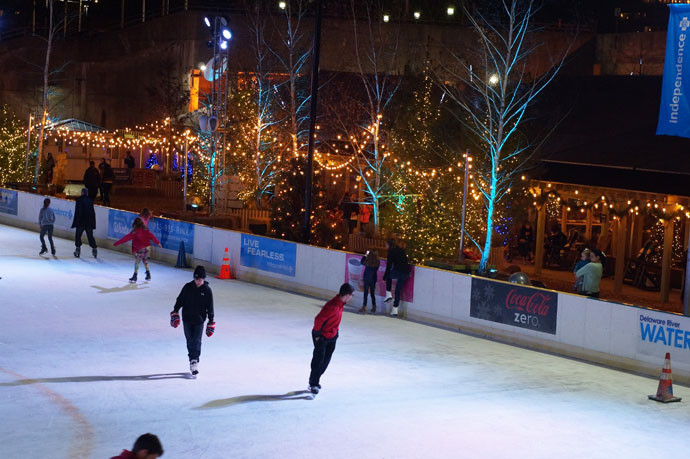
This screenshot has height=459, width=690. Find the location of `blue christmas lights`. blue christmas lights is located at coordinates (148, 163), (175, 167), (188, 168).